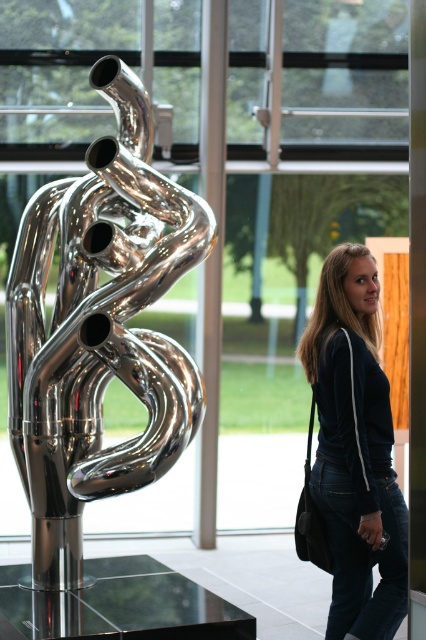
You are standing in the gallery and want to take a photo of the polished metallic sculpture at left without the dark blue denim jeans at lower right appearing in the frame. Is this possible based on their positions?

Answer: The polished metallic sculpture at left is closer to the viewer than the dark blue denim jeans at lower right. Since the sculpture is in front, you can position yourself so that the sculpture blocks the jeans from the camera view, making it possible to take a photo without the jeans appearing in the frame.

You are standing in the gallery and want to take a photo of the polished metallic sculpture at left without including the dark blue denim jeans at lower right in the frame. Is the sculpture positioned in a way that allows this?

The polished metallic sculpture at left is located above the dark blue denim jeans at lower right, so if you position yourself lower or adjust your angle to focus on the upper part of the sculpture, you can exclude the jeans from the frame.

You are standing in front of the metallic sculpture and want to take a photo of the point at coordinates point (138,182). If your camera can focus on objects up to 5 meters away, will you be able to capture that point clearly?

The distance of point (138,182) from camera is 5.69 meters, which is beyond the camera focus limit of 5 meters. Therefore, the point cannot be captured clearly.